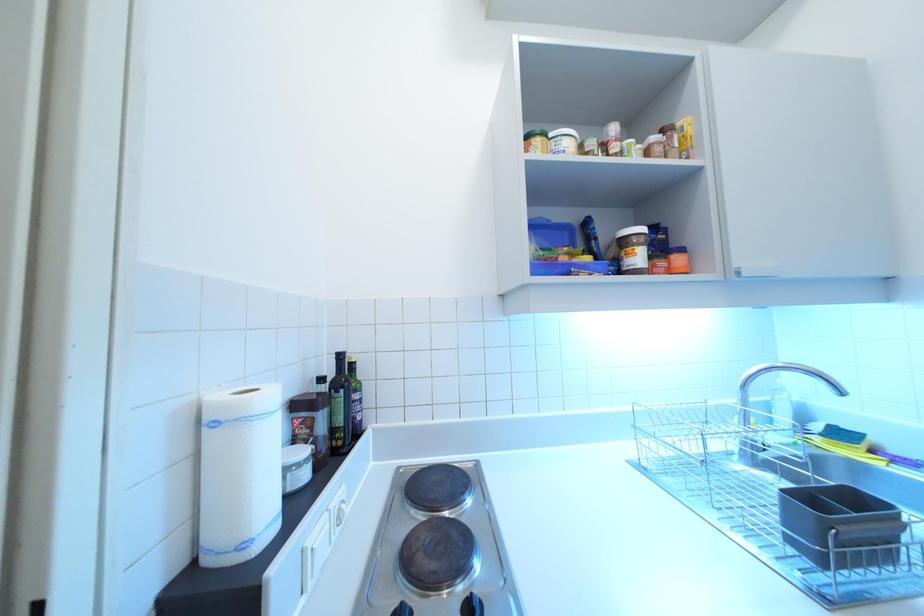
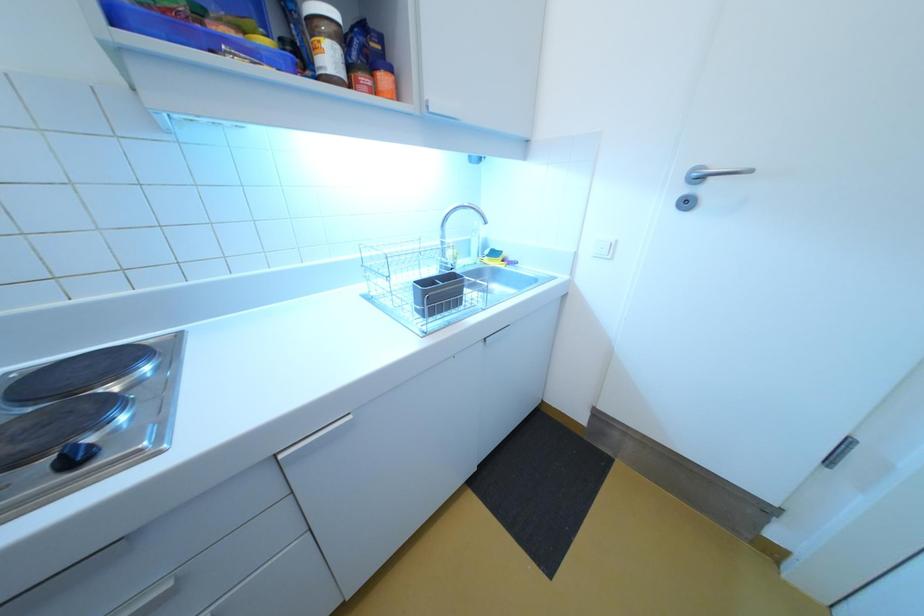
First-person continuous shooting, in which direction is the camera rotating?

The rotation direction of the camera is right-down.